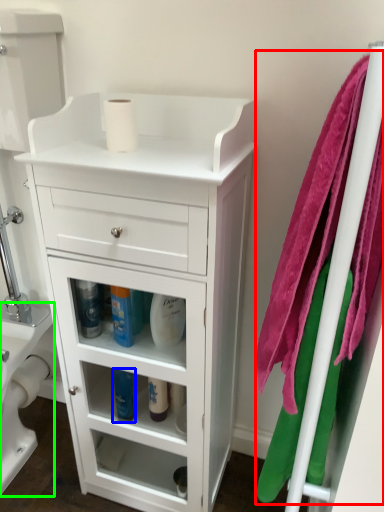
Question: Considering the real-world distances, which object is closest to bath towel (highlighted by a red box)? cleaning product (highlighted by a blue box) or toilet bowl (highlighted by a green box).

Choices:
 (A) cleaning product
 (B) toilet bowl

Answer: (A)